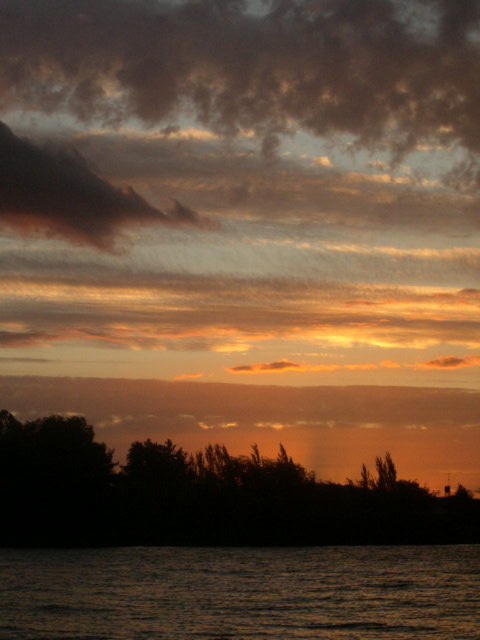
You are standing on a dock and looking at the dark water at bottom and the dark green leafy trees at lower center. Which object is located to the right side?

The dark green leafy trees at lower center are located to the right side of the dark water at bottom.

You are an artist trying to paint this sunset scene. You have a limited amount of dark green paint. The dark green leafy trees at lower center and the dark water at bottom both require this color. Which object will require more dark green paint?

The dark water at bottom requires more dark green paint because it is bigger than the dark green leafy trees at lower center.